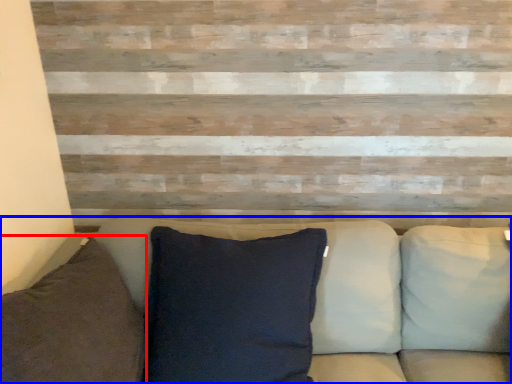
Question: Which object appears farthest to the camera in this image, pillow (highlighted by a red box) or studio couch (highlighted by a blue box)?

Choices:
 (A) pillow
 (B) studio couch

Answer: (B)